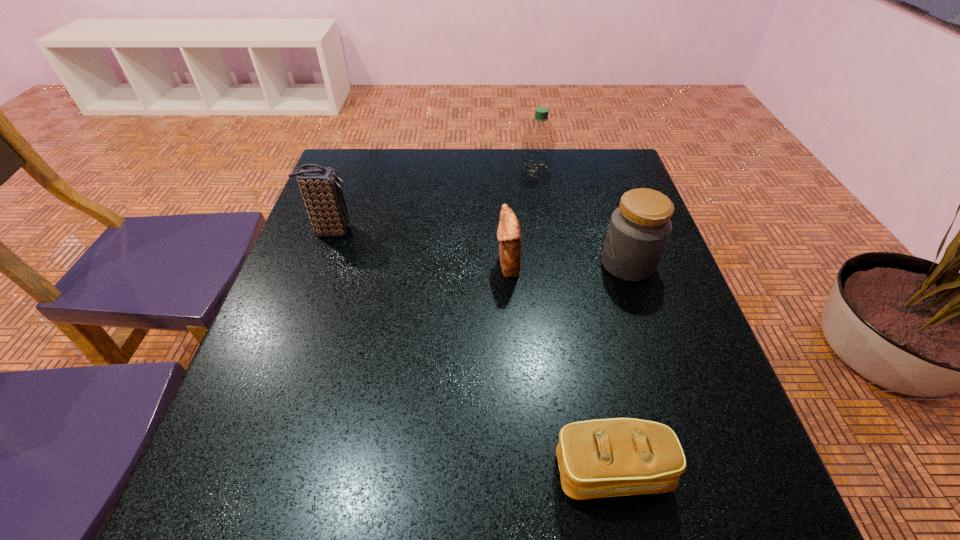
I want to click on the farthest object, so click(538, 142).

Where is `the leftmost object`? This screenshot has width=960, height=540. the leftmost object is located at coordinates (321, 189).

Locate an element on the screen. The height and width of the screenshot is (540, 960). the tallest clutch bag is located at coordinates (321, 189).

In order to click on jar in this screenshot , I will do `click(639, 229)`.

Where is `the second clutch bag from right to left`? the second clutch bag from right to left is located at coordinates (509, 234).

This screenshot has width=960, height=540. Find the location of `the second object from left to right`. the second object from left to right is located at coordinates (509, 234).

Identify the location of the shortest clutch bag. The image size is (960, 540). [600, 458].

In order to click on the nearest object in this screenshot , I will do `click(600, 458)`.

Locate an element on the screen. Image resolution: width=960 pixels, height=540 pixels. vacant space positioned on the front of the farthest object is located at coordinates (540, 200).

Find the location of a particular element. The height and width of the screenshot is (540, 960). vacant space located 0.070m with the zip open on the tallest clutch bag is located at coordinates (382, 231).